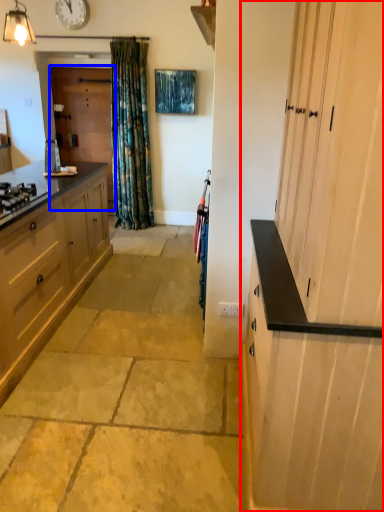
Question: Among these objects, which one is nearest to the camera, cabinetry (highlighted by a red box) or screen door (highlighted by a blue box)?

Choices:
 (A) cabinetry
 (B) screen door

Answer: (A)